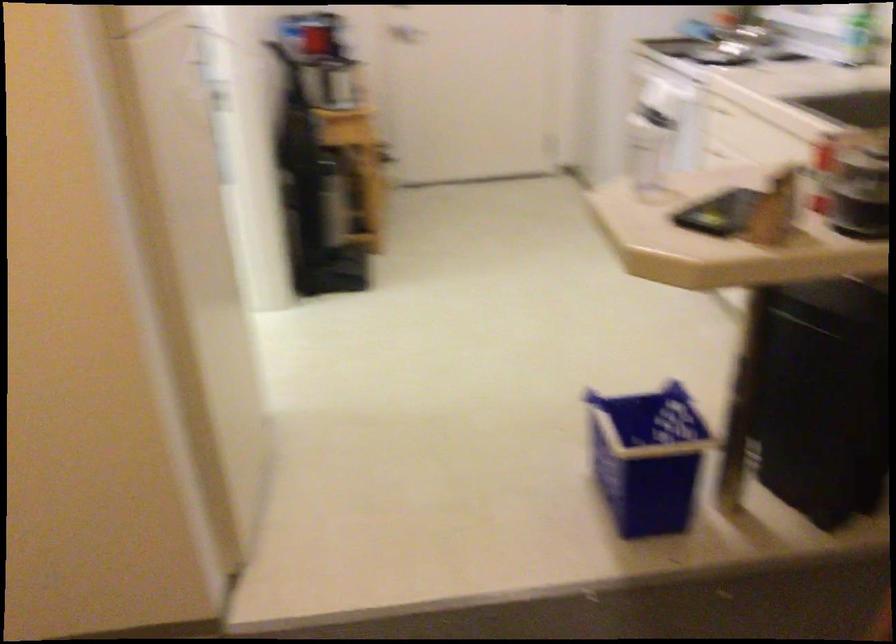
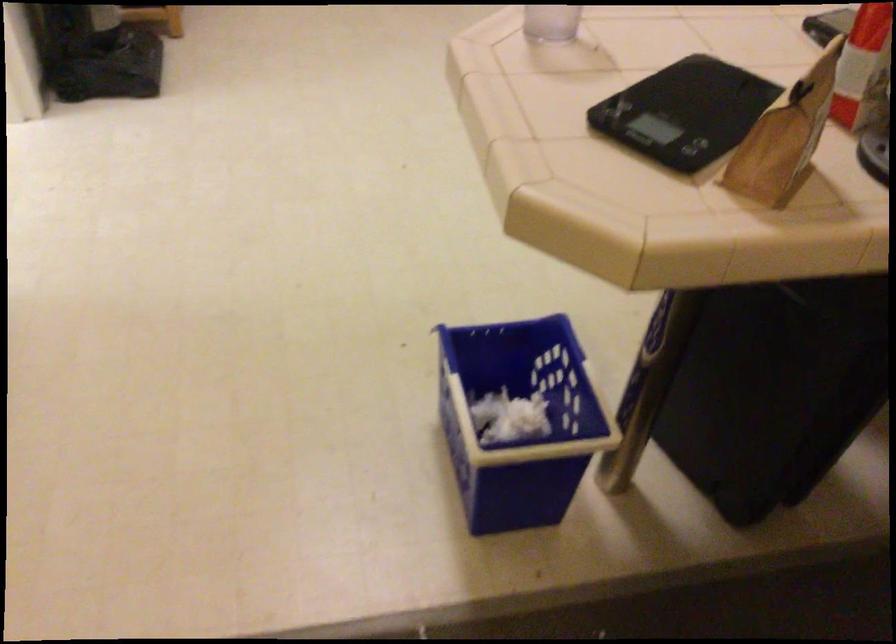
Question: How did the camera likely rotate?

Choices:
 (A) Left
 (B) Right
 (C) Up
 (D) Down

Answer: (D)